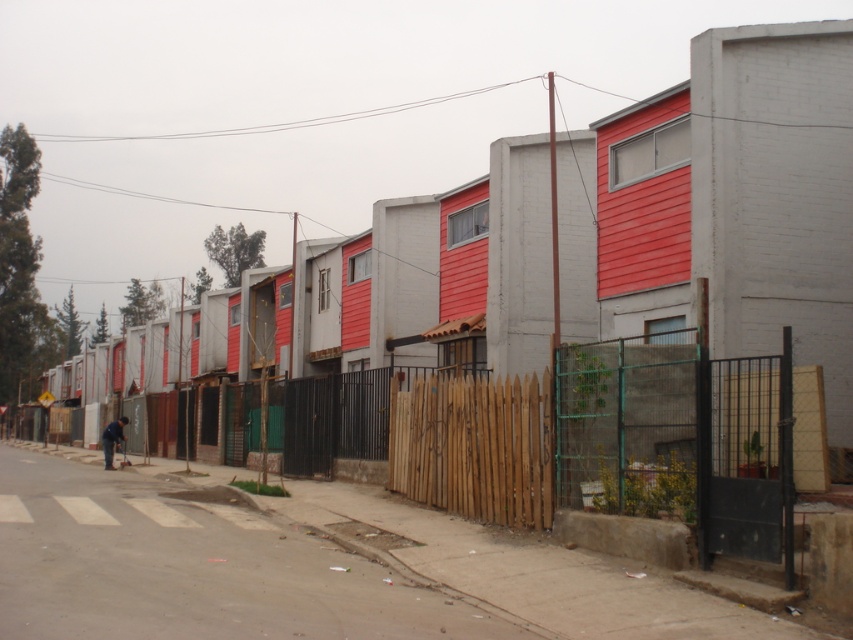
Question: Which point is closer to the camera?

Choices:
 (A) brown wooden fence at center
 (B) dark blue jeans at lower left
 (C) concrete sidewalk at lower center
 (D) wooden fence at center

Answer: (C)

Question: Considering the real-world distances, which object is closest to the dark blue jeans at lower left?

Choices:
 (A) brown wooden fence at center
 (B) wooden fence at center
 (C) concrete sidewalk at lower center

Answer: (C)

Question: Is wooden fence at center to the right of dark blue jeans at lower left from the viewer's perspective?

Choices:
 (A) no
 (B) yes

Answer: (B)

Question: Which of the following is the closest to the observer?

Choices:
 (A) (729, 432)
 (B) (520, 396)
 (C) (112, 440)
 (D) (167, 502)

Answer: (A)

Question: Does concrete sidewalk at lower center have a greater width compared to brown wooden fence at center?

Choices:
 (A) yes
 (B) no

Answer: (A)

Question: Is wooden fence at center to the left of brown wooden fence at center from the viewer's perspective?

Choices:
 (A) no
 (B) yes

Answer: (B)